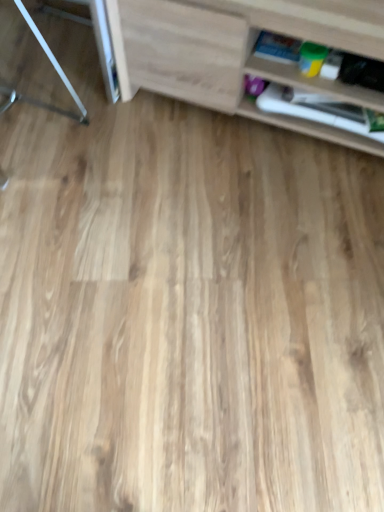
Where is `free location to the left of light wood cabinet at upper right, placed as the 1th shelf when sorted from front to back`? The image size is (384, 512). free location to the left of light wood cabinet at upper right, placed as the 1th shelf when sorted from front to back is located at coordinates (91, 150).